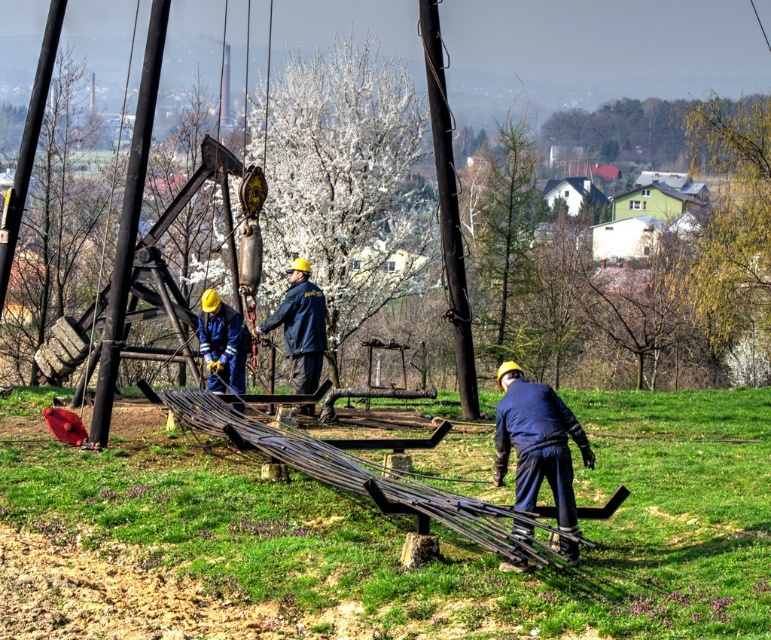
You are a safety inspector observing the construction site. You notice two blue fabric items at the center of the scene. Which one is closer to you, the blue fabric jacket at center or the blue fabric worker at center?

The blue fabric jacket at center is closer to you because the blue fabric worker at center is behind it.

You are a safety inspector standing at the center of the construction site. You need to ensure that workers are maintaining a safe distance of at least 10 meters apart for safety protocols. Are the blue fabric worker at lower right and blue fabric worker at center complying with this requirement?

The blue fabric worker at lower right and blue fabric worker at center are 9.36 meters apart from each other, which is less than the required 10 meters. Therefore, they are not complying with the safety protocols.

You are a safety inspector assessing the scene. You notice two workers wearing blue fabric clothing. Which worker, the blue fabric worker at lower right or the blue fabric worker at center, is standing at a higher elevation?

The blue fabric worker at lower right is taller than the blue fabric worker at center, so the blue fabric worker at lower right is standing at a higher elevation.